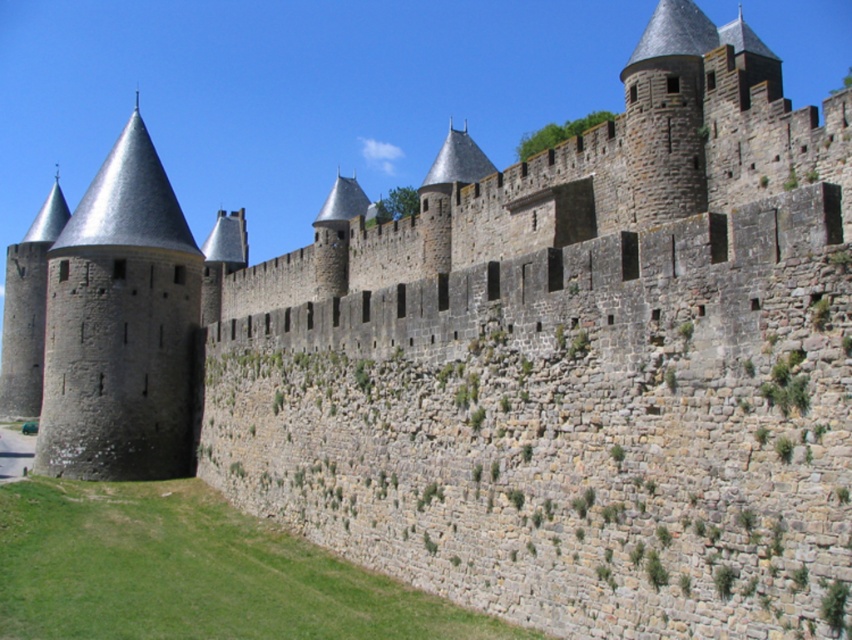
Question: Does green grass at lower left appear on the right side of dark gray stone tower at left?

Choices:
 (A) no
 (B) yes

Answer: (B)

Question: Does green grass at lower left have a smaller size compared to dark gray stone tower at left?

Choices:
 (A) yes
 (B) no

Answer: (A)

Question: Can you confirm if green grass at lower left is thinner than dark gray stone tower at left?

Choices:
 (A) no
 (B) yes

Answer: (B)

Question: Among these objects, which one is nearest to the camera?

Choices:
 (A) green grass at lower left
 (B) dark gray stone tower at left

Answer: (A)

Question: Which point is farther to the camera?

Choices:
 (A) green grass at lower left
 (B) dark gray stone tower at left

Answer: (B)